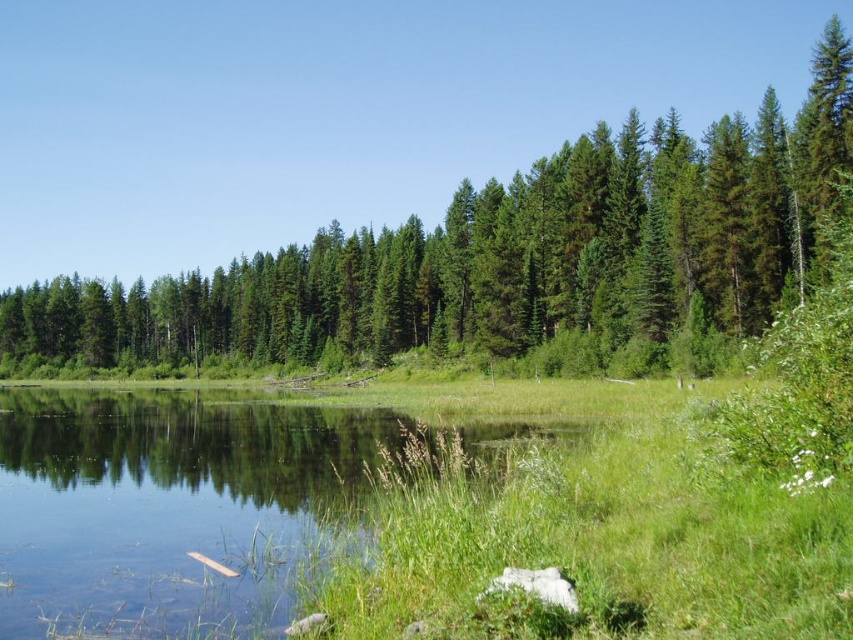
Question: Does green matte trees at center have a larger size compared to green grassy lake at center?

Choices:
 (A) yes
 (B) no

Answer: (A)

Question: Among these points, which one is nearest to the camera?

Choices:
 (A) (343, 339)
 (B) (210, 582)

Answer: (B)

Question: Is green matte trees at center smaller than green grassy lake at center?

Choices:
 (A) yes
 (B) no

Answer: (B)

Question: Can you confirm if green matte trees at center is smaller than green grassy lake at center?

Choices:
 (A) yes
 (B) no

Answer: (B)

Question: Which object is farther from the camera taking this photo?

Choices:
 (A) green matte trees at center
 (B) green grassy lake at center

Answer: (A)